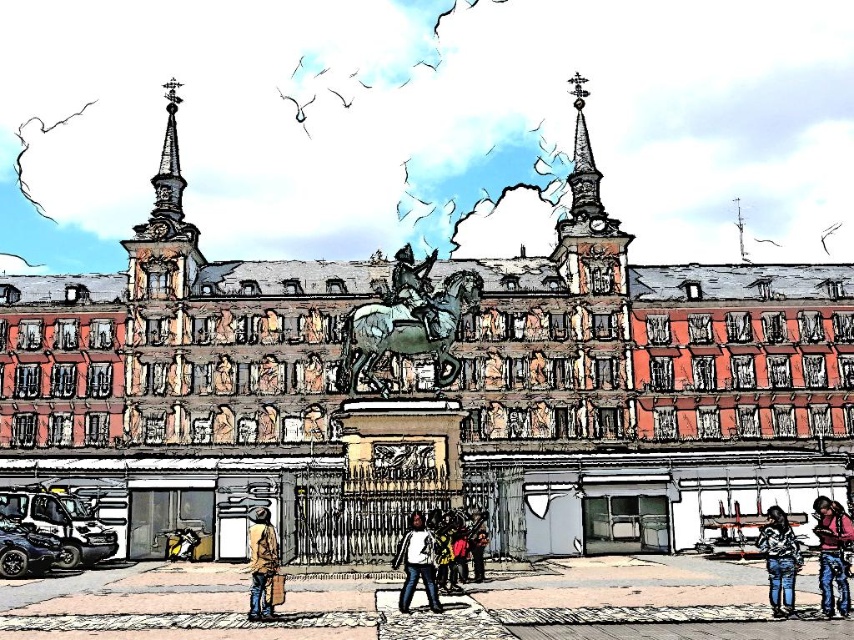
Question: Among these points, which one is farthest from the camera?

Choices:
 (A) (414, 541)
 (B) (773, 534)

Answer: (B)

Question: Which point is farther from the camera taking this photo?

Choices:
 (A) (418, 513)
 (B) (254, 528)

Answer: (A)

Question: Is denim jacket at lower right to the right of brown leather jacket at lower center from the viewer's perspective?

Choices:
 (A) yes
 (B) no

Answer: (A)

Question: Can you confirm if denim jacket at lower right is positioned to the left of white matte shirt at center?

Choices:
 (A) no
 (B) yes

Answer: (A)

Question: Among these objects, which one is farthest from the camera?

Choices:
 (A) white matte shirt at center
 (B) brown leather jacket at lower center

Answer: (A)

Question: Can you confirm if pink fabric jacket at lower right is bigger than white matte shirt at center?

Choices:
 (A) no
 (B) yes

Answer: (B)